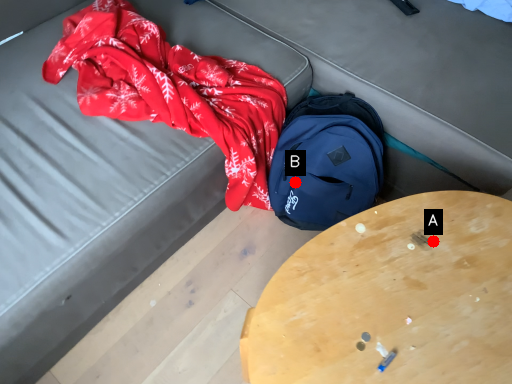
Question: Two points are circled on the image, labeled by A and B beside each circle. Among these points, which one is nearest to the camera?

Choices:
 (A) A is closer
 (B) B is closer

Answer: (A)